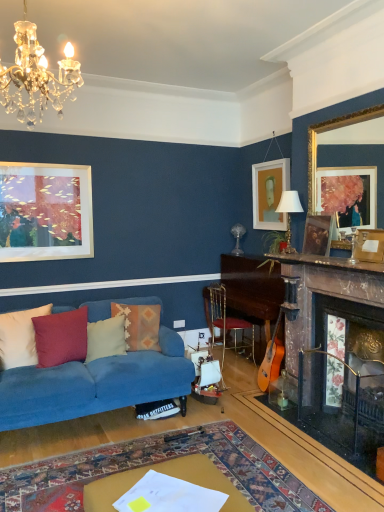
What do you see at coordinates (328, 130) in the screenshot?
I see `gold-framed mirror at upper right, which ranks as the 4th picture frame in back-to-front order` at bounding box center [328, 130].

You are a GUI agent. You are given a task and a screenshot of the screen. Output one action in this format:
    pyautogui.click(x=<x>, y=<y>)
    Task: Click on the white soft cushion at left, placed as the 4th pillow when sorted from right to left
    The height and width of the screenshot is (512, 384).
    Given the screenshot: What is the action you would take?
    pyautogui.click(x=19, y=337)

What do you see at coordinates (170, 475) in the screenshot? I see `white paper at lower center, which is counted as the first table, starting from the front` at bounding box center [170, 475].

Find the location of `blue fabric couch at lower left`. blue fabric couch at lower left is located at coordinates (94, 384).

Find the location of `wooden picture frame at right, which is counted as the 3th picture frame, starting from the back`. wooden picture frame at right, which is counted as the 3th picture frame, starting from the back is located at coordinates (369, 245).

Locate an element on the screen. gold metallic lampshade at upper center is located at coordinates (289, 214).

You are a GUI agent. You are given a task and a screenshot of the screen. Output one action in this format:
    pyautogui.click(x=<x>, y=<y>)
    Task: Click on the velvet cushion at left, the second pillow in the left-to-right sequence
    Image resolution: width=384 pixels, height=512 pixels.
    Given the screenshot: What is the action you would take?
    pyautogui.click(x=61, y=337)

Is point (281, 254) closer to viewer compared to point (127, 309)?

No, it is not.

What's the angular difference between wooden mantle at upper center and textured woolen pillow at center, which appears as the fourth pillow when viewed from the left,'s facing directions?

wooden mantle at upper center and textured woolen pillow at center, which appears as the fourth pillow when viewed from the left, are facing 74.1 degrees away from each other.

Considering the relative positions of wooden mantle at upper center and textured woolen pillow at center, the 1th pillow positioned from the right, in the image provided, is wooden mantle at upper center to the left of textured woolen pillow at center, the 1th pillow positioned from the right, from the viewer's perspective?

→ In fact, wooden mantle at upper center is to the right of textured woolen pillow at center, the 1th pillow positioned from the right.

From a real-world perspective, who is located higher, wooden mantle at upper center or textured woolen pillow at center, the 1th pillow positioned from the right?

wooden mantle at upper center is physically above.

At what (x,y) coordinates should I click in order to perform the action: click on mantle in front of the white matte picture frame at upper center, which is counted as the fourth picture frame, starting from the front. Please return your answer as a coordinate pair (x, y). Looking at the image, I should click on (327, 262).

From a real-world perspective, is wooden mantle at upper center positioned over white matte picture frame at upper center, the first picture frame from the back, based on gravity?

No, from a real-world perspective, wooden mantle at upper center is not on top of white matte picture frame at upper center, the first picture frame from the back.

Visually, is wooden mantle at upper center positioned to the left or to the right of white matte picture frame at upper center, the first picture frame from the back?

Clearly, wooden mantle at upper center is on the right of white matte picture frame at upper center, the first picture frame from the back, in the image.

Can you confirm if wooden mantle at upper center is taller than white matte picture frame at upper center, which is counted as the fourth picture frame, starting from the front?

No.

Which object is wider, light blue fabric pillow at center, which is the second pillow in right-to-left order, or wooden picture frame at right, which is counted as the 3th picture frame, starting from the back?

With larger width is light blue fabric pillow at center, which is the second pillow in right-to-left order.

How many degrees apart are the facing directions of light blue fabric pillow at center, which is the second pillow in right-to-left order, and wooden picture frame at right, placed as the second picture frame when sorted from front to back?

The angular difference between light blue fabric pillow at center, which is the second pillow in right-to-left order, and wooden picture frame at right, placed as the second picture frame when sorted from front to back, is 77 degrees.

Looking at the image, does light blue fabric pillow at center, which is the second pillow in right-to-left order, seem bigger or smaller compared to wooden picture frame at right, placed as the second picture frame when sorted from front to back?

In the image, light blue fabric pillow at center, which is the second pillow in right-to-left order, appears to be larger than wooden picture frame at right, placed as the second picture frame when sorted from front to back.

Based on the photo, can you confirm if wooden picture frame at upper right, which is the 2th picture frame in back-to-front order, is smaller than velvet cushion at left, which is the third pillow in right-to-left order?

Yes, wooden picture frame at upper right, which is the 2th picture frame in back-to-front order, is smaller than velvet cushion at left, which is the third pillow in right-to-left order.

Does point (307, 219) lie in front of point (80, 326)?

No, it is not.

How many degrees apart are the facing directions of wooden picture frame at upper right, which is the 2th picture frame in back-to-front order, and velvet cushion at left, the second pillow in the left-to-right sequence?

The angular difference between wooden picture frame at upper right, which is the 2th picture frame in back-to-front order, and velvet cushion at left, the second pillow in the left-to-right sequence, is 107 degrees.

From a real-world perspective, is wooden picture frame at upper right, the 3th picture frame positioned from the front, physically below velvet cushion at left, which is the third pillow in right-to-left order?

No, from a real-world perspective, wooden picture frame at upper right, the 3th picture frame positioned from the front, is not under velvet cushion at left, which is the third pillow in right-to-left order.

Would you consider white soft cushion at left, placed as the 4th pillow when sorted from right to left, to be distant from gold metallic lampshade at upper center?

A: That's right, there is a large distance between white soft cushion at left, placed as the 4th pillow when sorted from right to left, and gold metallic lampshade at upper center.

What's the angular difference between white soft cushion at left, the first pillow from the left, and gold metallic lampshade at upper center's facing directions?

white soft cushion at left, the first pillow from the left, and gold metallic lampshade at upper center are facing 103 degrees away from each other.

Between white soft cushion at left, the first pillow from the left, and gold metallic lampshade at upper center, which one has smaller width?

Thinner between the two is white soft cushion at left, the first pillow from the left.

What are the coordinates of `the 3rd pillow in front of the gold metallic lampshade at upper center` in the screenshot? It's located at (19, 337).

From the image's perspective, between metallic gold chair at center and textured woolen pillow at center, the 1th pillow positioned from the right, who is located below?

metallic gold chair at center is shown below in the image.

From the picture: Is metallic gold chair at center with textured woolen pillow at center, which appears as the fourth pillow when viewed from the left?

They are not placed beside each other.

Is point (211, 326) closer to camera compared to point (150, 341)?

That is False.

From a real-world perspective, is metallic gold chair at center positioned above or below textured woolen pillow at center, which appears as the fourth pillow when viewed from the left?

metallic gold chair at center is situated lower than textured woolen pillow at center, which appears as the fourth pillow when viewed from the left, in the real world.

Based on the photo, which is less distant, (x=21, y=311) or (x=212, y=286)?

The point (x=21, y=311) is more forward.

Where is `chair that is below the white soft cushion at left, placed as the 4th pillow when sorted from right to left (from the image's perspective)`? The height and width of the screenshot is (512, 384). chair that is below the white soft cushion at left, placed as the 4th pillow when sorted from right to left (from the image's perspective) is located at coordinates (226, 320).

Is metallic gold chair at center at the back of white soft cushion at left, placed as the 4th pillow when sorted from right to left?

white soft cushion at left, placed as the 4th pillow when sorted from right to left, does not have its back to metallic gold chair at center.

Is white soft cushion at left, the first pillow from the left, not near metallic gold chair at center?

That's right, there is a large distance between white soft cushion at left, the first pillow from the left, and metallic gold chair at center.

In order to click on mantle above the textured woolen pillow at center, which appears as the fourth pillow when viewed from the left (from a real-world perspective) in this screenshot , I will do `click(327, 262)`.

In order to click on the 4th picture frame behind when counting from the wooden mantle at upper center in this screenshot , I will do `click(269, 193)`.

When comparing their distances from blue fabric couch at lower left, does gold metallic lampshade at upper center or light blue fabric pillow at center, which is the second pillow in right-to-left order, seem closer?

Based on the image, light blue fabric pillow at center, which is the second pillow in right-to-left order, appears to be nearer to blue fabric couch at lower left.

Looking at the image, which one is located further to white soft cushion at left, the first pillow from the left, metallic gold chair at center or wooden mantle at upper center?

wooden mantle at upper center.

From the image, which object appears to be farther from blue fabric couch at lower left, light blue fabric pillow at center, which is the second pillow in right-to-left order, or wooden picture frame at right, placed as the second picture frame when sorted from front to back?

Based on the image, wooden picture frame at right, placed as the second picture frame when sorted from front to back, appears to be further to blue fabric couch at lower left.

Considering their positions, is metallic gold chair at center positioned closer to wooden fireplace at right than wooden mantle at upper center?

wooden mantle at upper center.

Looking at the image, which one is located closer to wooden picture frame at right, which is counted as the 3th picture frame, starting from the back, textured woolen pillow at center, the 1th pillow positioned from the right, or metallic gold chair at center?

Among the two, textured woolen pillow at center, the 1th pillow positioned from the right, is located nearer to wooden picture frame at right, which is counted as the 3th picture frame, starting from the back.

In the scene shown: Estimate the real-world distances between objects in this image. Which object is further from blue fabric couch at lower left, wooden fireplace at right or wooden table at center, acting as the 2th table starting from the front?

wooden table at center, acting as the 2th table starting from the front, lies further to blue fabric couch at lower left than the other object.

When comparing their distances from gold-framed mirror at upper right, the 1th picture frame viewed from the front, does velvet cushion at left, the second pillow in the left-to-right sequence, or blue fabric couch at lower left seem further?

velvet cushion at left, the second pillow in the left-to-right sequence, lies further to gold-framed mirror at upper right, the 1th picture frame viewed from the front, than the other object.

Looking at the image, which one is located closer to gold-framed mirror at upper right, which ranks as the 4th picture frame in back-to-front order, wooden mantle at upper center or metallic gold chair at center?

Based on the image, wooden mantle at upper center appears to be nearer to gold-framed mirror at upper right, which ranks as the 4th picture frame in back-to-front order.

The image size is (384, 512). I want to click on lamp situated between white soft cushion at left, placed as the 4th pillow when sorted from right to left, and wooden mantle at upper center from left to right, so click(x=289, y=214).

Identify the location of fireplace situated between blue fabric couch at lower left and wooden picture frame at right, which is counted as the 3th picture frame, starting from the back, from left to right. Image resolution: width=384 pixels, height=512 pixels. (335, 355).

Where is `studio couch located between white paper at lower center, placed as the second table when sorted from back to front, and white matte picture frame at upper center, the first picture frame from the back, in the depth direction`? The image size is (384, 512). studio couch located between white paper at lower center, placed as the second table when sorted from back to front, and white matte picture frame at upper center, the first picture frame from the back, in the depth direction is located at coordinates pos(94,384).

Locate an element on the screen. This screenshot has height=512, width=384. picture frame between white soft cushion at left, placed as the 4th pillow when sorted from right to left, and wooden mantle at upper center, in the horizontal direction is located at coordinates [x=269, y=193].